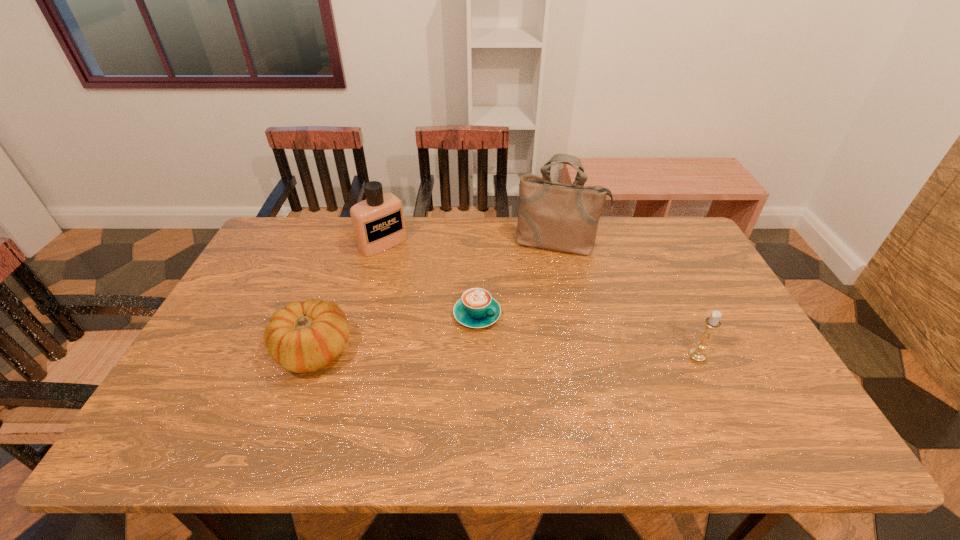
Identify the location of vacant space on the desktop that is between the gourd and the candle holder and is positioned on the front-facing side of the fourth object from left to right. This screenshot has width=960, height=540. (540, 353).

Identify the location of vacant space on the desktop that is between the second shortest object and the rightmost object and is positioned with the handle on the right side of the shortest object. The width and height of the screenshot is (960, 540). (551, 354).

I want to click on free space on the desktop that is between the fourth tallest object and the rightmost object and is positioned on the front label of the fourth shortest object, so click(502, 353).